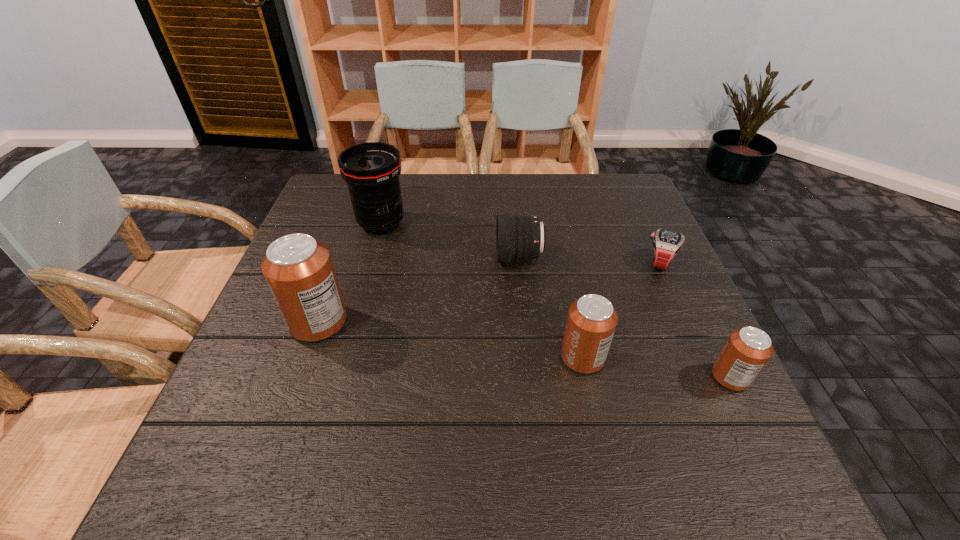
In order to click on telephoto lens that is at the left edge in this screenshot , I will do pyautogui.click(x=371, y=170).

You are a GUI agent. You are given a task and a screenshot of the screen. Output one action in this format:
    pyautogui.click(x=<x>, y=<y>)
    Task: Click on the can located at the right edge
    The image size is (960, 540).
    Given the screenshot: What is the action you would take?
    pyautogui.click(x=747, y=350)

Identify the location of watch positioned at the right edge. This screenshot has height=540, width=960. (667, 244).

At what (x,y) coordinates should I click in order to perform the action: click on object at the far left corner. Please return your answer as a coordinate pair (x, y). The image size is (960, 540). Looking at the image, I should click on (371, 170).

Locate an element on the screen. object positioned at the near right corner is located at coordinates (747, 350).

Image resolution: width=960 pixels, height=540 pixels. What are the coordinates of `vacant space at the far edge of the desktop` in the screenshot? It's located at (557, 200).

In the image, there is a desktop. At what (x,y) coordinates should I click in order to perform the action: click on vacant area at the left edge. Please return your answer as a coordinate pair (x, y). Looking at the image, I should click on (337, 238).

At what (x,y) coordinates should I click in order to perform the action: click on blank area at the right edge. Please return your answer as a coordinate pair (x, y). The image size is (960, 540). Looking at the image, I should click on (654, 231).

At what (x,y) coordinates should I click in order to perform the action: click on vacant area at the far right corner of the desktop. Please return your answer as a coordinate pair (x, y). Image resolution: width=960 pixels, height=540 pixels. Looking at the image, I should click on (629, 182).

Locate an element on the screen. The image size is (960, 540). free space between the fourth shortest object and the farther telephoto lens is located at coordinates (482, 291).